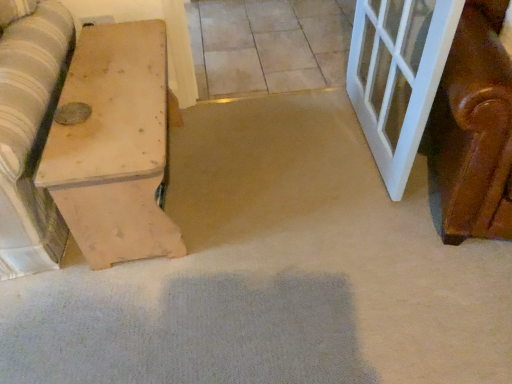
Question: From the image's perspective, is neutral stone tile at center on light brown wood chest at left?

Choices:
 (A) no
 (B) yes

Answer: (B)

Question: Can you confirm if neutral stone tile at center is positioned to the left of light brown wood chest at left?

Choices:
 (A) yes
 (B) no

Answer: (B)

Question: From a real-world perspective, is neutral stone tile at center over light brown wood chest at left?

Choices:
 (A) no
 (B) yes

Answer: (A)

Question: Is the depth of neutral stone tile at center greater than that of light brown wood chest at left?

Choices:
 (A) yes
 (B) no

Answer: (A)

Question: Is neutral stone tile at center positioned beyond the bounds of light brown wood chest at left?

Choices:
 (A) yes
 (B) no

Answer: (A)

Question: Can you confirm if neutral stone tile at center is bigger than light brown wood chest at left?

Choices:
 (A) yes
 (B) no

Answer: (B)

Question: Can you confirm if light brown wood chest at left is wider than neutral stone tile at center?

Choices:
 (A) no
 (B) yes

Answer: (A)

Question: Is light brown wood chest at left to the left of neutral stone tile at center from the viewer's perspective?

Choices:
 (A) yes
 (B) no

Answer: (A)

Question: From a real-world perspective, is light brown wood chest at left physically above neutral stone tile at center?

Choices:
 (A) no
 (B) yes

Answer: (B)

Question: From the image's perspective, is light brown wood chest at left under neutral stone tile at center?

Choices:
 (A) no
 (B) yes

Answer: (B)

Question: Is light brown wood chest at left positioned with its back to neutral stone tile at center?

Choices:
 (A) no
 (B) yes

Answer: (A)

Question: Does light brown wood chest at left have a lesser height compared to neutral stone tile at center?

Choices:
 (A) no
 (B) yes

Answer: (A)

Question: Based on their positions, is light brown wood chest at left located to the left or right of neutral stone tile at center?

Choices:
 (A) right
 (B) left

Answer: (B)